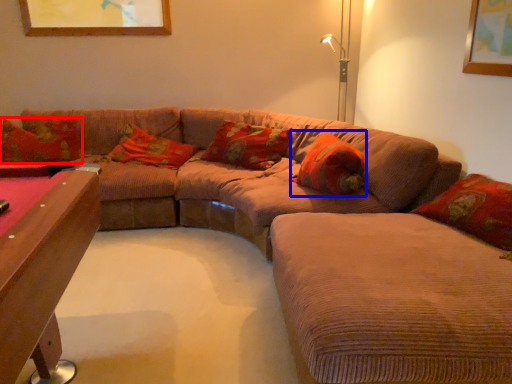
Question: Which of the following is the closest to the observer, pillow (highlighted by a red box) or pillow (highlighted by a blue box)?

Choices:
 (A) pillow
 (B) pillow

Answer: (B)